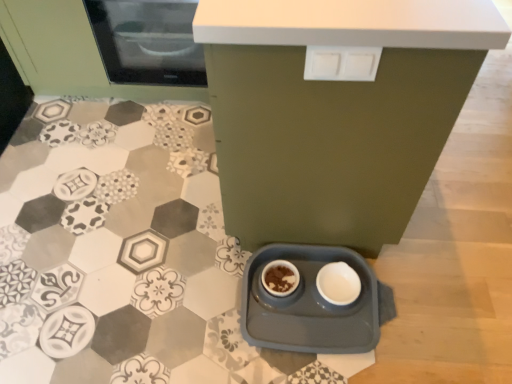
Locate an element on the screen. The height and width of the screenshot is (384, 512). vacant space to the right of matte ceramic bowl at center is located at coordinates (332, 297).